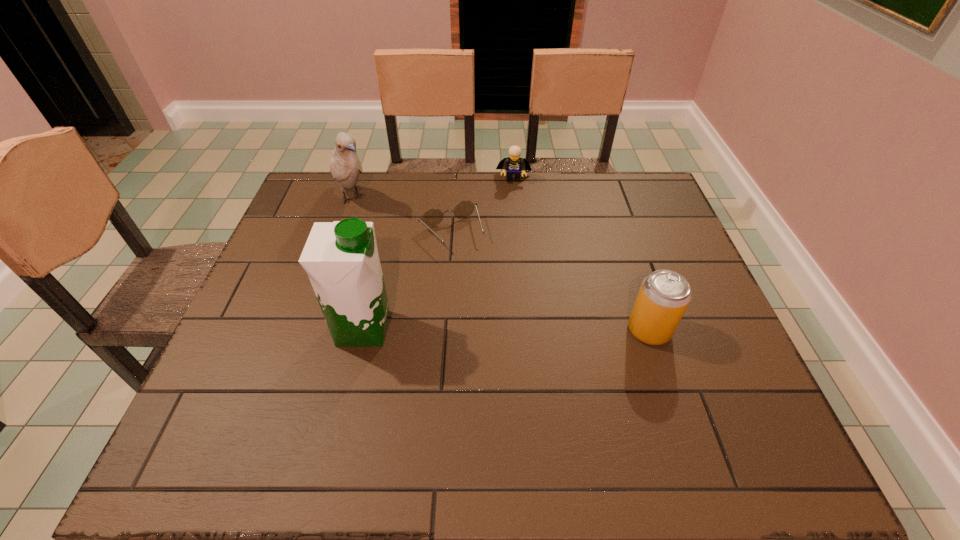
Locate an element on the screen. The height and width of the screenshot is (540, 960). bird that is at the far edge is located at coordinates (345, 166).

In order to click on Lego situated at the far edge in this screenshot , I will do `click(512, 165)`.

At what (x,y) coordinates should I click in order to perform the action: click on object positioned at the left edge. Please return your answer as a coordinate pair (x, y). Looking at the image, I should click on (345, 166).

I want to click on object present at the right edge, so click(x=664, y=295).

You are a GUI agent. You are given a task and a screenshot of the screen. Output one action in this format:
    pyautogui.click(x=<x>, y=<y>)
    Task: Click on the object that is at the far left corner
    The width and height of the screenshot is (960, 540).
    Given the screenshot: What is the action you would take?
    pyautogui.click(x=345, y=166)

At what (x,y) coordinates should I click in order to perform the action: click on vacant point at the far edge. Please return your answer as a coordinate pair (x, y). Looking at the image, I should click on (493, 184).

Find the location of a particular element. Image resolution: width=960 pixels, height=540 pixels. free space at the near edge of the desktop is located at coordinates (288, 395).

Identify the location of free region at the left edge of the desktop. This screenshot has width=960, height=540. (308, 227).

The height and width of the screenshot is (540, 960). Identify the location of free space at the right edge. (679, 261).

This screenshot has width=960, height=540. I want to click on blank space at the far left corner, so click(343, 204).